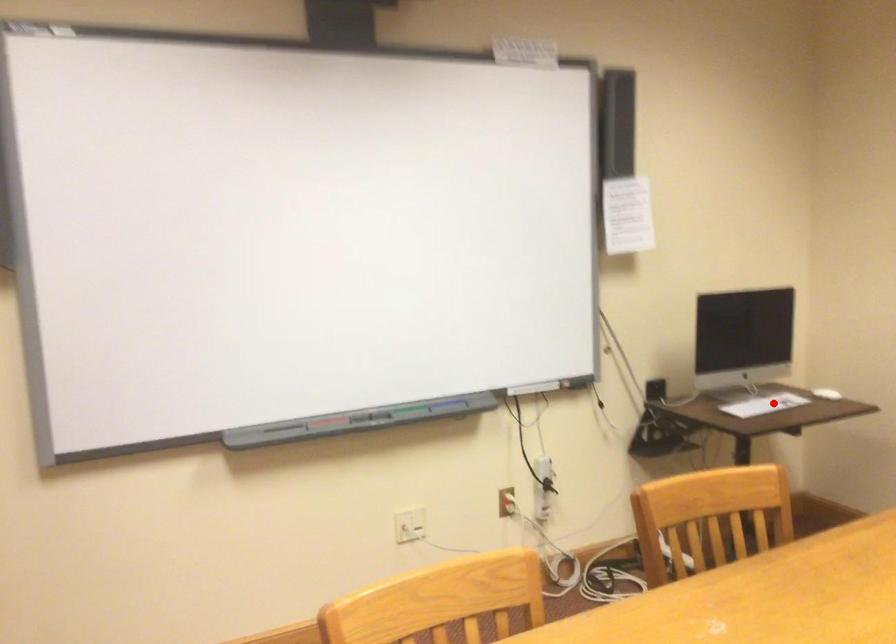
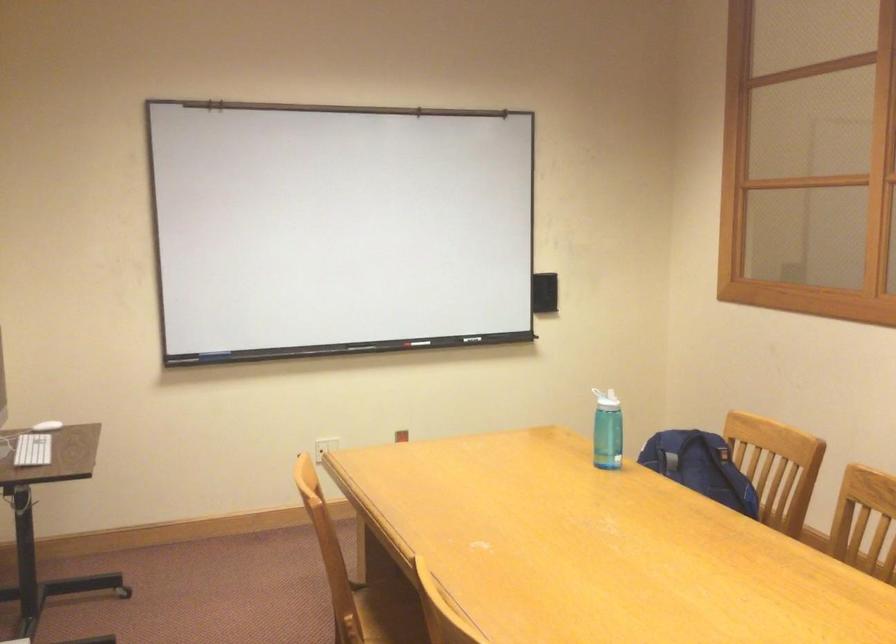
In the second image, find the point that corresponds to the highlighted location in the first image.

(32, 450)